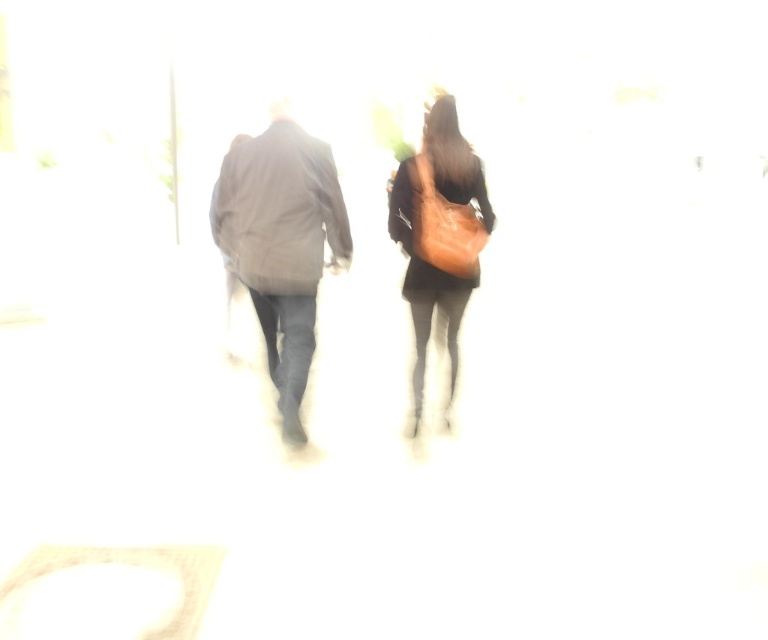
Is matte black coat at center below leather brown bag at center?

Indeed, matte black coat at center is positioned under leather brown bag at center.

Which is above, matte black coat at center or leather brown bag at center?

leather brown bag at center is higher up.

Is point (276, 355) closer to viewer compared to point (411, 168)?

No, it is behind (411, 168).

At what (x,y) coordinates should I click in order to perform the action: click on matte black coat at center. Please return your answer as a coordinate pair (x, y). Looking at the image, I should click on (442, 220).

Describe the element at coordinates (280, 243) in the screenshot. I see `dark gray suit at center` at that location.

At what (x,y) coordinates should I click in order to perform the action: click on dark gray suit at center. Please return your answer as a coordinate pair (x, y). The width and height of the screenshot is (768, 640). Looking at the image, I should click on (280, 243).

Which is behind, point (330, 232) or point (445, 209)?

Positioned behind is point (330, 232).

Where is `dark gray suit at center`? The image size is (768, 640). dark gray suit at center is located at coordinates (280, 243).

Is matte black coat at center wider than dark gray suit at center?

In fact, matte black coat at center might be narrower than dark gray suit at center.

Is matte black coat at center positioned behind dark gray suit at center?

Yes, matte black coat at center is behind dark gray suit at center.

Describe the element at coordinates (442, 220) in the screenshot. This screenshot has height=640, width=768. I see `matte black coat at center` at that location.

Locate an element on the screen. The height and width of the screenshot is (640, 768). matte black coat at center is located at coordinates (442, 220).